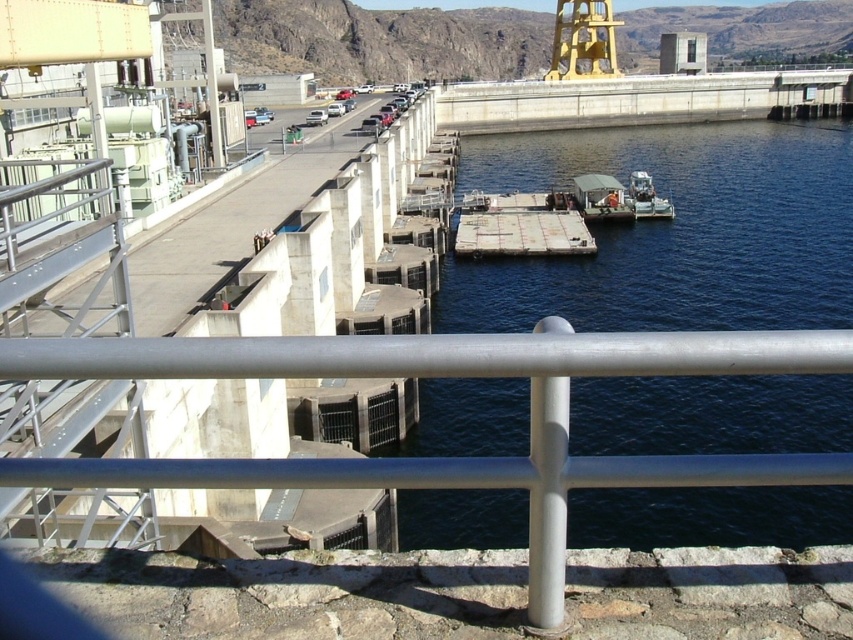
Can you confirm if blue water at center is wider than white plastic boat at center?

Yes, blue water at center is wider than white plastic boat at center.

Does point (712, 426) come behind point (639, 189)?

No, it is not.

At what (x,y) coordinates should I click in order to perform the action: click on blue water at center. Please return your answer as a coordinate pair (x, y). Looking at the image, I should click on (672, 230).

Is point (624, 218) farther from viewer compared to point (653, 211)?

No, (624, 218) is in front of (653, 211).

Is the position of white matte boat at center less distant than that of white plastic boat at center?

Yes, it is.

The image size is (853, 640). What do you see at coordinates (601, 198) in the screenshot? I see `white matte boat at center` at bounding box center [601, 198].

Image resolution: width=853 pixels, height=640 pixels. In order to click on white matte boat at center in this screenshot , I will do `click(601, 198)`.

Is point (689, 212) closer to viewer compared to point (625, 211)?

No, (689, 212) is behind (625, 211).

Does blue water at center have a larger size compared to white matte boat at center?

Correct, blue water at center is larger in size than white matte boat at center.

Which is behind, point (705, 326) or point (604, 193)?

The point (604, 193) is more distant.

The height and width of the screenshot is (640, 853). In order to click on blue water at center in this screenshot , I will do `click(672, 230)`.